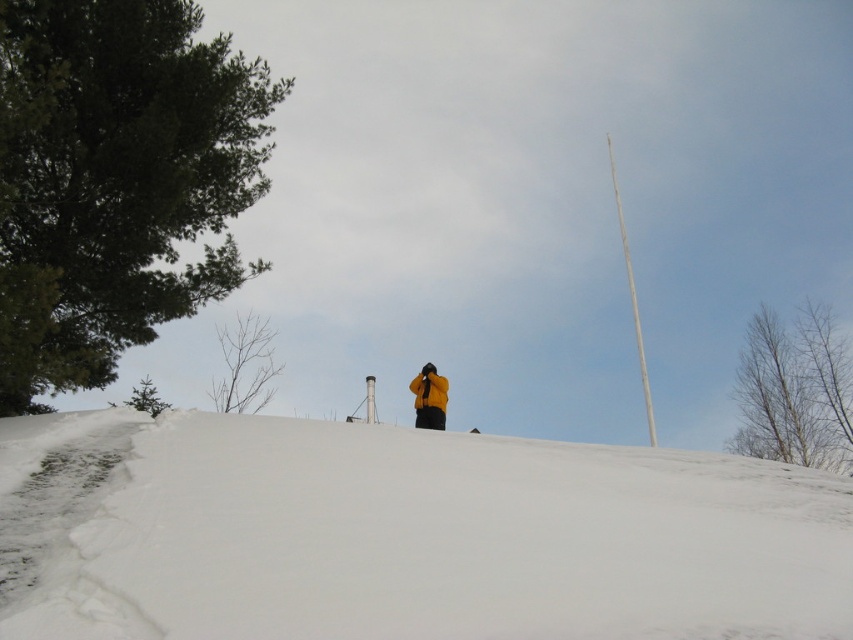
Question: Does green leafy tree at upper left have a greater width compared to bare branches at left?

Choices:
 (A) yes
 (B) no

Answer: (A)

Question: Based on their relative distances, which object is nearer to the green leafy tree at upper left?

Choices:
 (A) yellow matte jacket at center
 (B) white fluffy snow at center

Answer: (A)

Question: Can you confirm if green leafy tree at upper left is positioned below bare branches at upper center?

Choices:
 (A) yes
 (B) no

Answer: (B)

Question: Which point is farther to the camera?

Choices:
 (A) bare branches at upper center
 (B) green leafy tree at upper left

Answer: (A)

Question: Is white fluffy snow at center smaller than yellow matte jacket at center?

Choices:
 (A) no
 (B) yes

Answer: (B)

Question: Considering the real-world distances, which object is closest to the bare branches at upper center?

Choices:
 (A) yellow matte jacket at center
 (B) white fluffy snow at center
 (C) green leafy tree at upper left

Answer: (A)